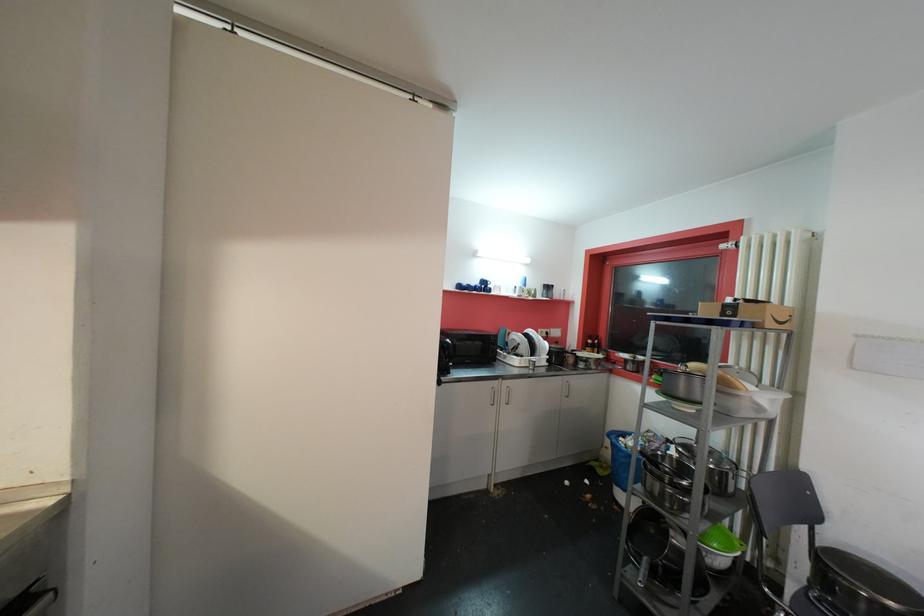
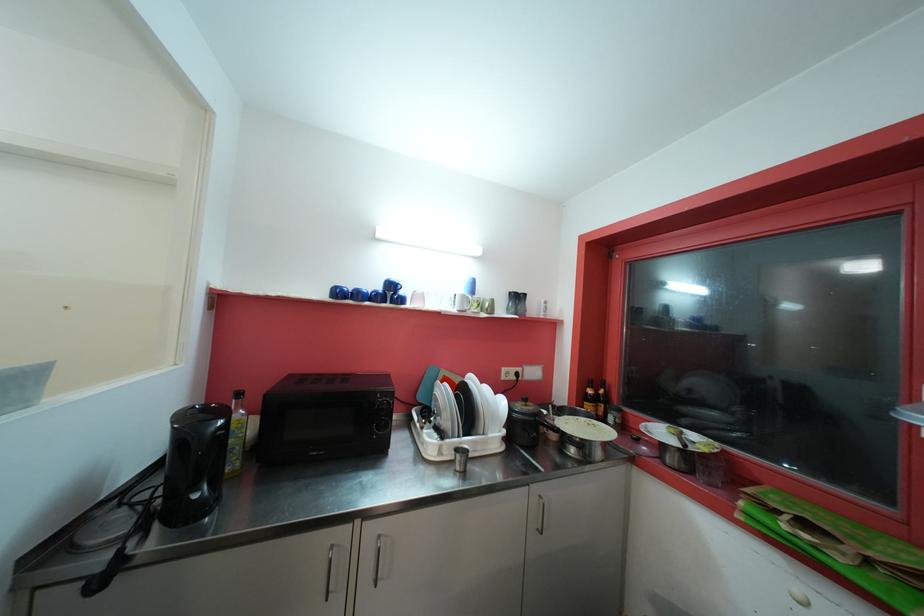
Where in the second image is the point corresponding to point (489, 285) from the first image?

(396, 288)